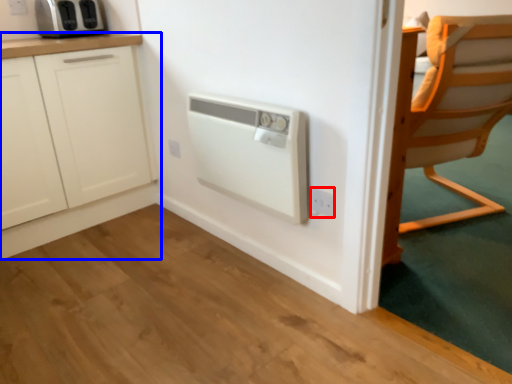
Question: Which point is closer to the camera, electric outlet (highlighted by a red box) or cabinetry (highlighted by a blue box)?

Choices:
 (A) electric outlet
 (B) cabinetry

Answer: (A)